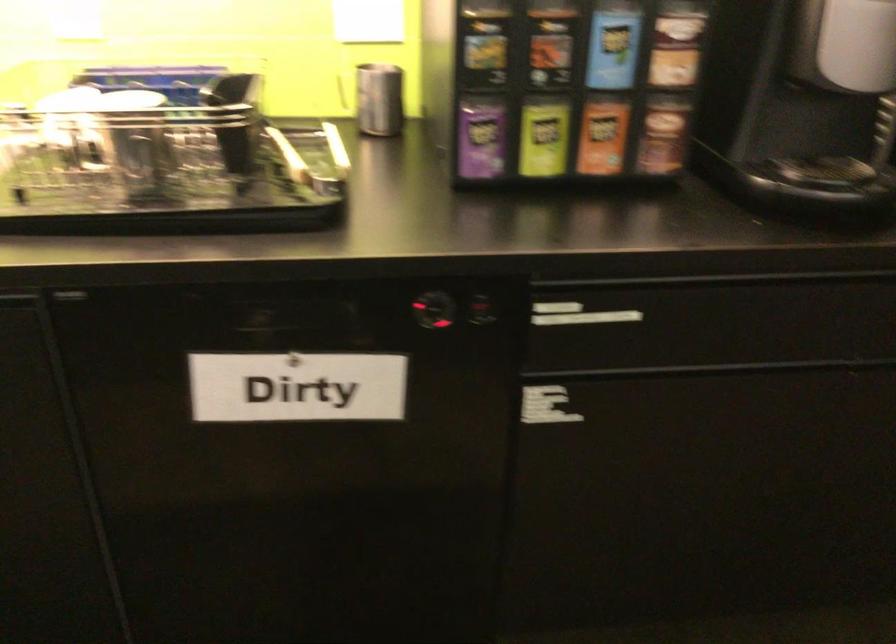
The location [543,138] corresponds to which object?

This point indicates the light green tea box.